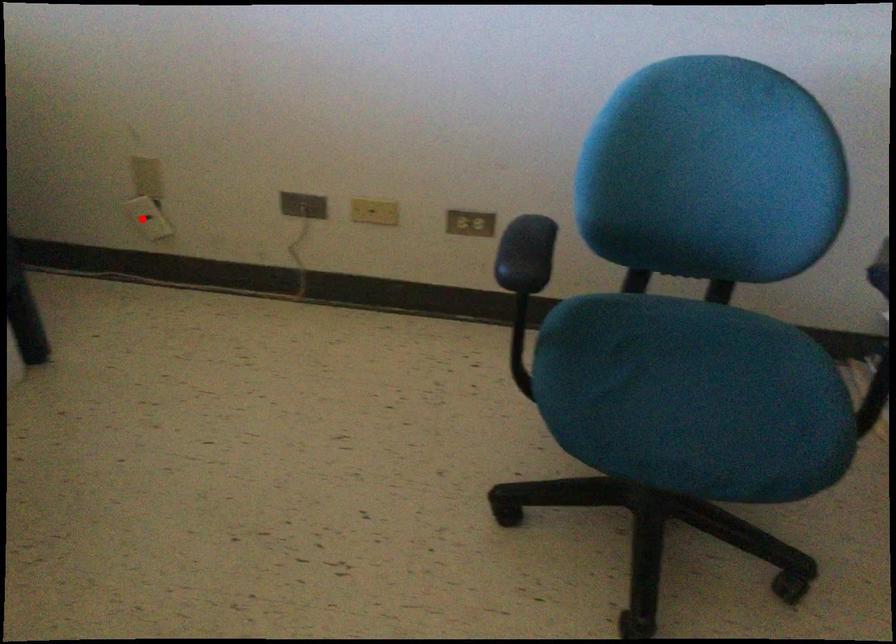
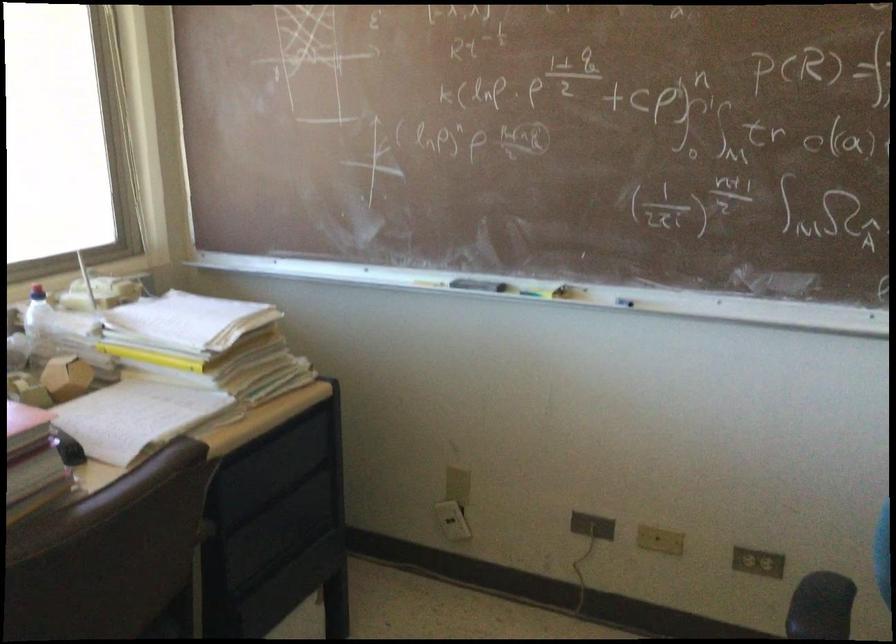
Where in the second image is the point corresponding to the highlighted location from the first image?

(452, 520)